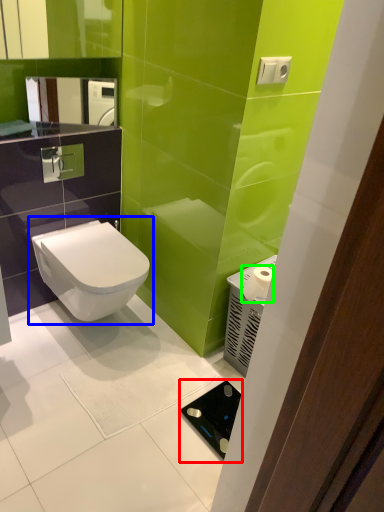
Question: Which is nearer to the appliance (highlighted by a red box)? toilet (highlighted by a blue box) or toilet paper (highlighted by a green box).

Choices:
 (A) toilet
 (B) toilet paper

Answer: (B)